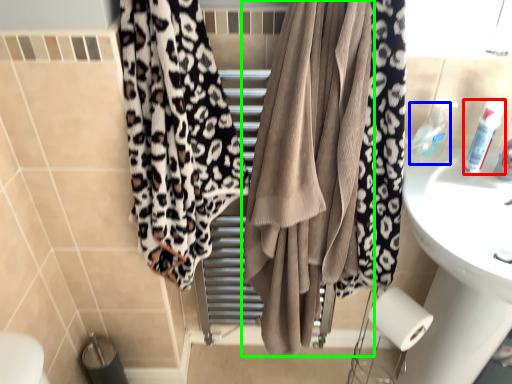
Question: Estimate the real-world distances between objects in this image. Which object is closer to toiletry (highlighted by a red box), toiletry (highlighted by a blue box) or curtain (highlighted by a green box)?

Choices:
 (A) toiletry
 (B) curtain

Answer: (A)